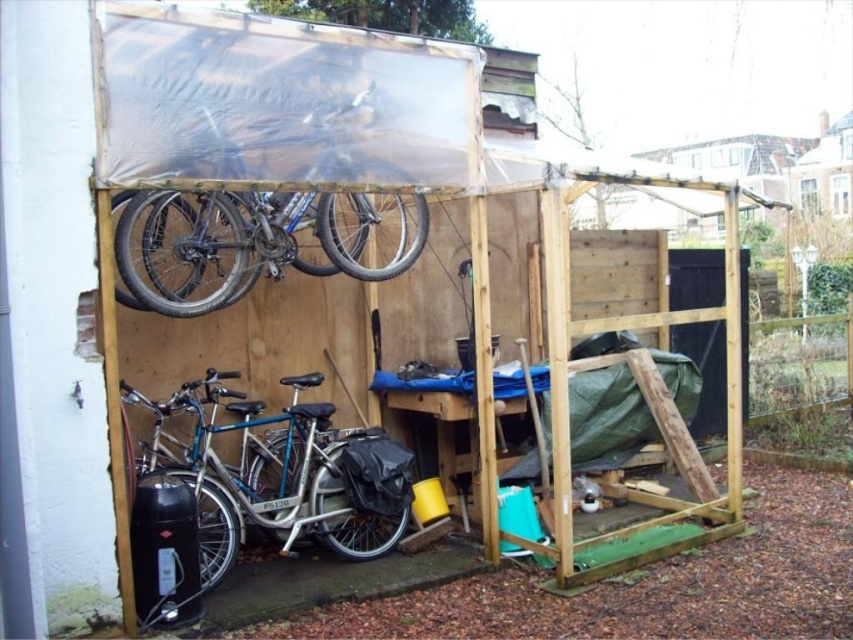
Based on the photo, you are standing inside the shelter and want to place a new item at the point marked by the coordinates point (x=280, y=474). What object is currently located at that position?

The silver metallic bicycle at lower left is located at point (x=280, y=474).

You are standing at the entrance of the storage shelter and need to retrieve the yellow bucket. Which object, the silver metallic bicycle at lower left or the black bag, is closer to you?

The black bag is closer to you because it is placed near the front of the shelter, whereas the silver metallic bicycle at lower left is hanging higher up and further back.

You are a maintenance worker needing to access the shiny metallic bicycle at upper center. Can you reach it without moving the silver metallic bicycle at lower left?

The silver metallic bicycle at lower left is positioned under the shiny metallic bicycle at upper center, so you can reach the shiny metallic bicycle at upper center without needing to move the silver metallic bicycle at lower left because they are stacked vertically.